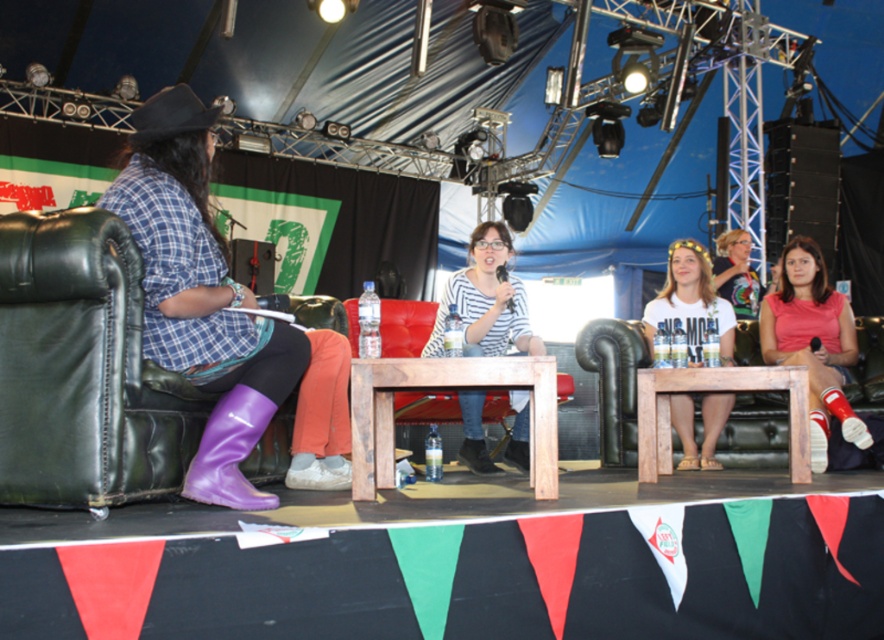
You are a photographer at the event and need to capture a photo that includes both the striped cotton shirt at center and the purple rubber boot at lower left. Which object should you place closer to the left side of the frame to ensure both are visible?

To ensure both the striped cotton shirt at center and the purple rubber boot at lower left are visible, place the purple rubber boot at lower left closer to the left side of the frame since it is positioned to the left of the striped cotton shirt at center.

You are standing at the point marked by the coordinates point (196,208). You want to walk to the tent entrance located 10 meters away in a straight line. Is there any object in your path that might block your way?

There are two black leather armchairs on the left side of the stage in your path, so you need to navigate around them to reach the tent entrance.